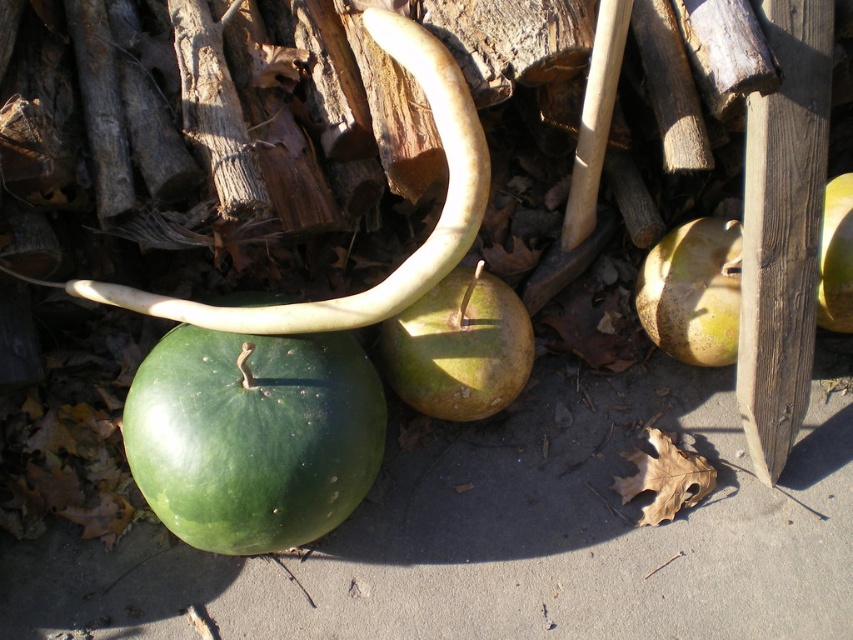
Question: Which object appears closest to the camera in this image?

Choices:
 (A) yellow smooth gourd at center
 (B) green matte gourd at center-right
 (C) green matte gourd at center

Answer: (A)

Question: Can you confirm if green matte gourd at center is smaller than green matte gourd at center-right?

Choices:
 (A) no
 (B) yes

Answer: (A)

Question: Which point appears farthest from the camera in this image?

Choices:
 (A) (834, 214)
 (B) (671, 336)

Answer: (B)

Question: Is green matte gourd at center to the right of green matte gourd at center-right from the viewer's perspective?

Choices:
 (A) no
 (B) yes

Answer: (A)

Question: Which point is farther from the camera taking this photo?

Choices:
 (A) (653, 296)
 (B) (219, 481)
 (C) (526, 353)
 (D) (838, 310)

Answer: (A)

Question: Considering the relative positions of green matte gourd at center and green matte gourd at center-right in the image provided, where is green matte gourd at center located with respect to green matte gourd at center-right?

Choices:
 (A) left
 (B) right

Answer: (A)